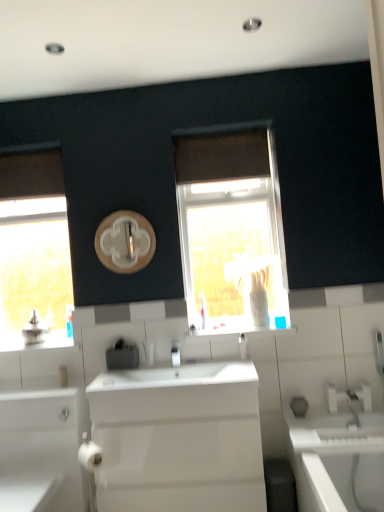
The height and width of the screenshot is (512, 384). What do you see at coordinates (342, 460) in the screenshot?
I see `white glossy bathtub at lower right` at bounding box center [342, 460].

Measure the distance between point (3, 507) and camera.

A distance of 5.94 feet exists between point (3, 507) and camera.

This screenshot has height=512, width=384. What do you see at coordinates (33, 248) in the screenshot?
I see `clear glass window at left, which is counted as the second window, starting from the right` at bounding box center [33, 248].

I want to click on white glossy sink at center, so click(x=177, y=439).

This screenshot has height=512, width=384. In order to click on translucent glass window at center, which is the 1th window in right-to-left order in this screenshot , I will do `click(231, 230)`.

Is white glossy window sill at center inside silver metallic tap at center?

Definitely not — white glossy window sill at center is not inside silver metallic tap at center.

Is silver metallic tap at center placed right next to white glossy window sill at center?

No, silver metallic tap at center is not touching white glossy window sill at center.

Between silver metallic tap at center and white glossy window sill at center, which one has larger size?

white glossy window sill at center.

Considering the sizes of objects silver metallic tap at center and white glossy window sill at center in the image provided, who is thinner, silver metallic tap at center or white glossy window sill at center?

With smaller width is silver metallic tap at center.

Is white glossy bathtub at lower right placed right next to black plastic soap dispenser at center, which ranks as the second appliance in back-to-front order?

No, white glossy bathtub at lower right is not touching black plastic soap dispenser at center, which ranks as the second appliance in back-to-front order.

Is point (364, 426) in front of point (106, 355)?

That is True.

Can we say white glossy bathtub at lower right lies outside black plastic soap dispenser at center, acting as the first appliance starting from the right?

Yes.

Would you consider white glossy bathtub at lower right to be distant from clear glass window at left, which ranks as the 2th window in front-to-back order?

Indeed, white glossy bathtub at lower right is not near clear glass window at left, which ranks as the 2th window in front-to-back order.

Based on the photo, is white glossy bathtub at lower right looking in the opposite direction of clear glass window at left, acting as the first window starting from the back?

No.

Considering the relative sizes of white glossy bathtub at lower right and clear glass window at left, acting as the first window starting from the back, in the image provided, is white glossy bathtub at lower right thinner than clear glass window at left, acting as the first window starting from the back,?

Incorrect, the width of white glossy bathtub at lower right is not less than that of clear glass window at left, acting as the first window starting from the back.

Considering the relative sizes of black plastic soap dispenser at center, the 1th appliance from the front, and white glossy cabinet at lower left in the image provided, is black plastic soap dispenser at center, the 1th appliance from the front, wider than white glossy cabinet at lower left?

No.

Is point (108, 351) behind point (45, 468)?

Yes, point (108, 351) is behind point (45, 468).

Considering the relative sizes of black plastic soap dispenser at center, which appears as the 2th appliance when viewed from the top, and white glossy cabinet at lower left in the image provided, is black plastic soap dispenser at center, which appears as the 2th appliance when viewed from the top, taller than white glossy cabinet at lower left?

Incorrect, the height of black plastic soap dispenser at center, which appears as the 2th appliance when viewed from the top, is not larger of that of white glossy cabinet at lower left.

Which object is positioned more to the left, black plastic soap dispenser at center, which ranks as the second appliance in back-to-front order, or white glossy cabinet at lower left?

white glossy cabinet at lower left is more to the left.

What's the angular difference between clear glass window at left, which ranks as the 2th window in front-to-back order, and translucent glass window at center, which is the 2th window in left-to-right order,'s facing directions?

The facing directions of clear glass window at left, which ranks as the 2th window in front-to-back order, and translucent glass window at center, which is the 2th window in left-to-right order, are 0.00273 degrees apart.

Can you confirm if clear glass window at left, which is counted as the second window, starting from the right, is positioned to the right of translucent glass window at center, the second window positioned from the back?

In fact, clear glass window at left, which is counted as the second window, starting from the right, is to the left of translucent glass window at center, the second window positioned from the back.

Considering the sizes of objects clear glass window at left, which ranks as the 2th window in front-to-back order, and translucent glass window at center, the 1th window from the front, in the image provided, who is bigger, clear glass window at left, which ranks as the 2th window in front-to-back order, or translucent glass window at center, the 1th window from the front,?

Bigger between the two is translucent glass window at center, the 1th window from the front.

From a real-world perspective, which is physically above, clear glass window at left, acting as the first window starting from the back, or translucent glass window at center, the 1th window from the front?

In real-world perspective, clear glass window at left, acting as the first window starting from the back, is above.

Which object is more forward, clear glass window at left, marked as the 1th window in a left-to-right arrangement, or translucent plastic tube at center?

Positioned in front is translucent plastic tube at center.

Based on the photo, is clear glass window at left, acting as the first window starting from the back, taller or shorter than translucent plastic tube at center?

In the image, clear glass window at left, acting as the first window starting from the back, appears to be taller than translucent plastic tube at center.

From a real-world perspective, is clear glass window at left, which is counted as the second window, starting from the right, on top of translucent plastic tube at center?

Correct, in the physical world, clear glass window at left, which is counted as the second window, starting from the right, is higher than translucent plastic tube at center.

Is clear glass window at left, acting as the first window starting from the back, facing away from translucent plastic tube at center?

clear glass window at left, acting as the first window starting from the back, does not have its back to translucent plastic tube at center.

This screenshot has height=512, width=384. I want to click on appliance behind the white glossy window sill at center, so click(x=34, y=329).

Which is behind, point (295, 328) or point (42, 337)?

The point (42, 337) is farther.

In the scene shown: Is white glossy window sill at center bigger or smaller than satin silver faucet at left, which is counted as the 2th appliance, starting from the bottom?

In the image, white glossy window sill at center appears to be larger than satin silver faucet at left, which is counted as the 2th appliance, starting from the bottom.

Is white glossy window sill at center far from satin silver faucet at left, the first appliance when ordered from back to front?

Yes, white glossy window sill at center is far from satin silver faucet at left, the first appliance when ordered from back to front.

Locate an element on the screen. tap below the white glossy window sill at center (from the image's perspective) is located at coordinates (175, 354).

Locate an element on the screen. Image resolution: width=384 pixels, height=512 pixels. bath on the right of the black plastic soap dispenser at center, the 1th appliance from the front is located at coordinates (342, 460).

Which object lies further to the anchor point black plastic soap dispenser at center, the 1th appliance from the front, white glossy bathtub at lower right or translucent glass window at center, which is the 2th window in left-to-right order?

white glossy bathtub at lower right lies further to black plastic soap dispenser at center, the 1th appliance from the front, than the other object.

Based on their spatial positions, is translucent plastic tube at center or white glossy sink at center further from clear plastic soap dispenser at center?

The object further to clear plastic soap dispenser at center is translucent plastic tube at center.

Looking at the image, which one is located closer to translucent plastic tube at center, clear plastic soap dispenser at center or translucent glass window at center, which is the 1th window in right-to-left order?

Among the two, clear plastic soap dispenser at center is located nearer to translucent plastic tube at center.

When comparing their distances from silver metallic tap at center, does translucent plastic tube at center or white glossy cabinet at lower left seem closer?

Answer: translucent plastic tube at center.

Estimate the real-world distances between objects in this image. Which object is closer to black plastic soap dispenser at center, which appears as the 2th appliance when viewed from the top, satin silver faucet at left, which appears as the 2th appliance when viewed from the right, or white glossy bathtub at lower right?

satin silver faucet at left, which appears as the 2th appliance when viewed from the right, lies closer to black plastic soap dispenser at center, which appears as the 2th appliance when viewed from the top, than the other object.

Estimate the real-world distances between objects in this image. Which object is closer to translucent glass window at center, the second window positioned from the back, clear glass window at left, marked as the 1th window in a left-to-right arrangement, or white glossy bathtub at lower right?

Based on the image, white glossy bathtub at lower right appears to be nearer to translucent glass window at center, the second window positioned from the back.

In the scene shown: Which object lies nearer to the anchor point white glossy cabinet at lower left, white glossy bathtub at lower right or clear glass window at left, acting as the first window starting from the back?

white glossy bathtub at lower right lies closer to white glossy cabinet at lower left than the other object.

Based on their spatial positions, is clear glass window at left, marked as the 1th window in a left-to-right arrangement, or white glossy cabinet at lower left further from white glossy window sill at center?

The object further to white glossy window sill at center is clear glass window at left, marked as the 1th window in a left-to-right arrangement.

In order to click on window sill situated between translucent plastic tube at center and white glossy bathtub at lower right from left to right in this screenshot , I will do `click(243, 327)`.

Where is `tap that lies between wooden circle at center and black plastic soap dispenser at center, which ranks as the second appliance in back-to-front order, from top to bottom`? The width and height of the screenshot is (384, 512). tap that lies between wooden circle at center and black plastic soap dispenser at center, which ranks as the second appliance in back-to-front order, from top to bottom is located at coordinates (175, 354).

Where is `tap between translucent glass window at center, the 1th window from the front, and white glossy sink at center vertically`? The height and width of the screenshot is (512, 384). tap between translucent glass window at center, the 1th window from the front, and white glossy sink at center vertically is located at coordinates (175, 354).

Locate an element on the screen. The image size is (384, 512). window sill situated between satin silver faucet at left, which is the first appliance from left to right, and white glossy bathtub at lower right from left to right is located at coordinates (243, 327).